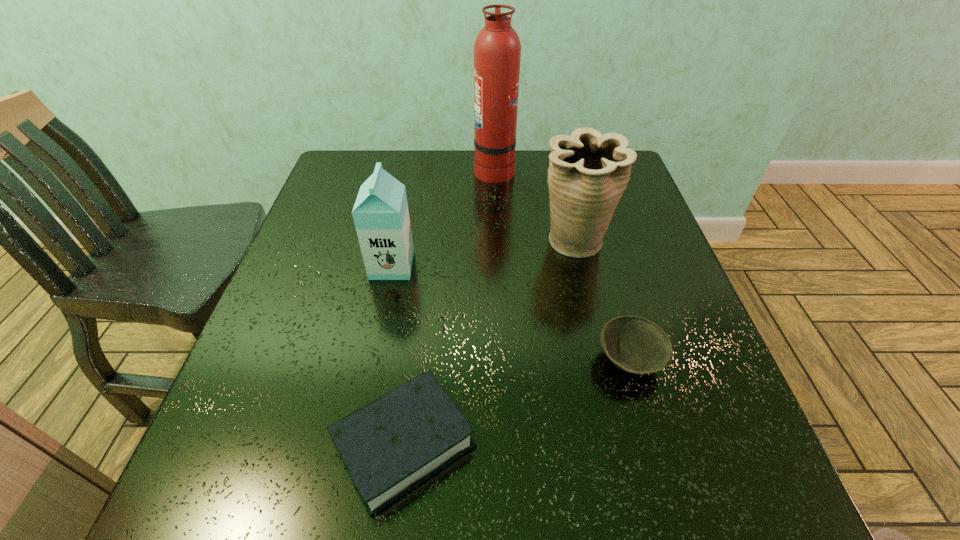
This screenshot has width=960, height=540. In order to click on empty location between the bowl and the urn in this screenshot , I will do `click(601, 301)`.

Select which object is the fourth closest to the milk carton. Please provide its 2D coordinates. Your answer should be formatted as a tuple, i.e. [(x, y)], where the tuple contains the x and y coordinates of a point satisfying the conditions above.

[(634, 344)]

Find the location of a particular element. object identified as the second closest to the bowl is located at coordinates (392, 444).

This screenshot has height=540, width=960. I want to click on vacant space that satisfies the following two spatial constraints: 1. on the back side of the milk carton; 2. on the left side of the urn, so tap(396, 242).

Locate an element on the screen. The height and width of the screenshot is (540, 960). vacant region that satisfies the following two spatial constraints: 1. on the back side of the urn; 2. on the left side of the Bible is located at coordinates (429, 242).

Where is `vacant area in the image that satisfies the following two spatial constraints: 1. on the front side of the milk carton; 2. on the left side of the bowl`? Image resolution: width=960 pixels, height=540 pixels. vacant area in the image that satisfies the following two spatial constraints: 1. on the front side of the milk carton; 2. on the left side of the bowl is located at coordinates (372, 360).